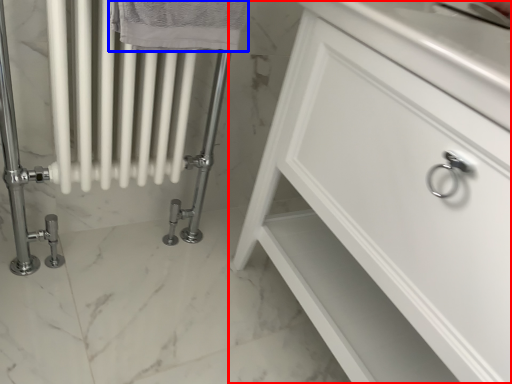
Question: Which of the following is the closest to the observer, bathroom cabinet (highlighted by a red box) or bath towel (highlighted by a blue box)?

Choices:
 (A) bathroom cabinet
 (B) bath towel

Answer: (A)